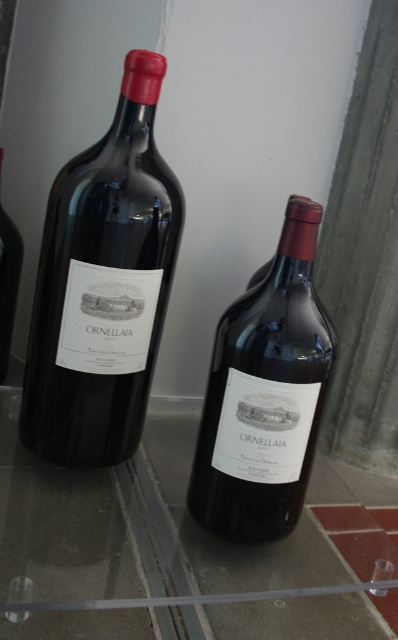
You are arranging wine bottles on a shelf and want to place the matte glass bottle at left on the transparent glass table at center. Can you place it directly on top without it falling off?

The transparent glass table at center is below the matte glass bottle at left, so placing the matte glass bottle at left directly on top would be possible as the table is positioned under it. However, stability depends on the table surface area and bottle base. Since the description doesn

You are standing in front of a wine display and want to place a small decorative item on the transparent glass table at center. However, you notice the matte glass bottle at left nearby. Which object should you place the item on to ensure it is closer to you?

The transparent glass table at center is closer to the viewer than the matte glass bottle at left, so you should place the item on the transparent glass table at center to ensure it is closer to you.

You are standing in front of a glass shelf displaying two bottles of wine. There are two points marked on the shelf, one at coordinate point (x=290, y=426) and the other at point (x=0, y=314). Which point is closer to you?

Point (x=290, y=426) is closer to the viewer than point (x=0, y=314).